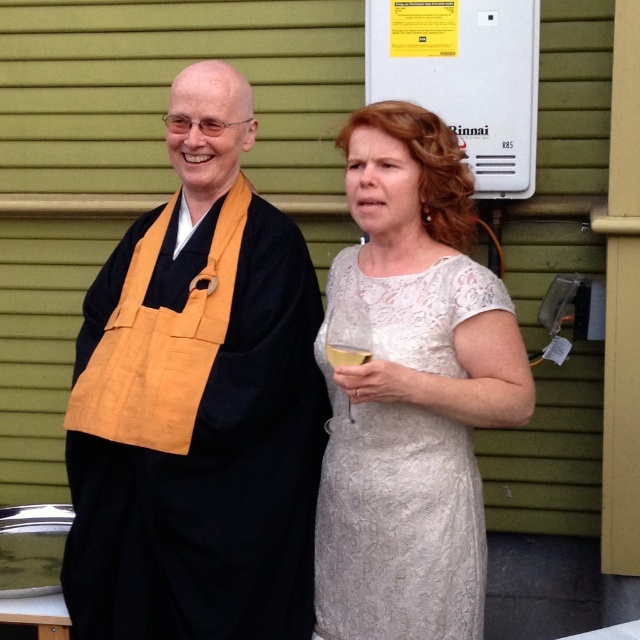
From the picture: You are a photographer setting up for a portrait. You notice the clear glass wine glass at lower center and the translucent glass at upper center in the scene. Which glass is positioned closer to your camera lens?

The clear glass wine glass at lower center is closer to the viewer than the translucent glass at upper center, so it is positioned closer to the camera lens.

You are standing at the position of the person on the left wearing traditional attire. You want to move to the point marked as point (349,316). However, there is an obstacle at point (189,401). Can you reach your destination without going around the obstacle?

Point (189,401) is in front of point (349,316), so you cannot reach point (349,316) without going around the obstacle at point (189,401).